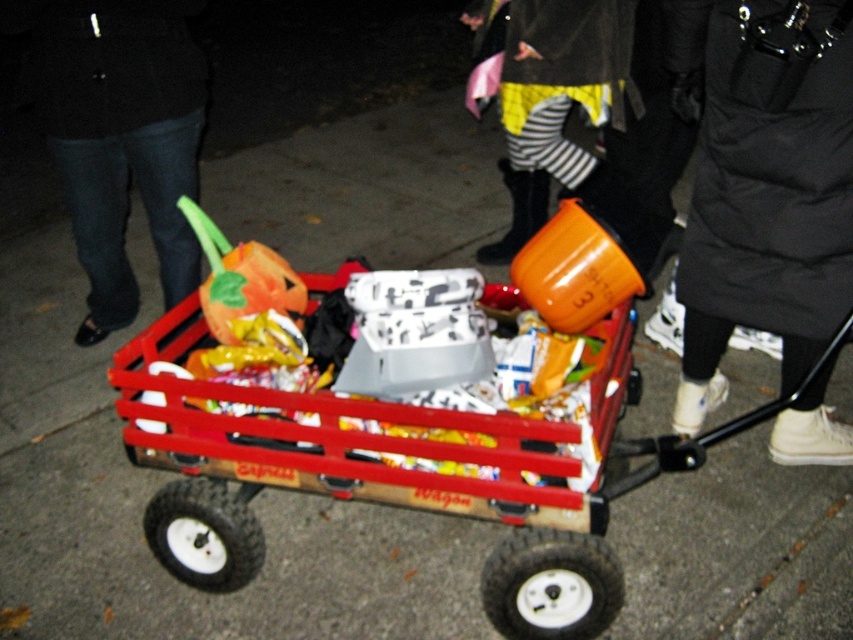
Looking at this image, you are a costume designer trying to decide which Halloween costume to wear tonight. You have two options in the image, the black puffy coat at upper right and the striped fabric pants at center. Which costume piece is narrower?

The black puffy coat at upper right has a lesser width compared to striped fabric pants at center, so the black puffy coat at upper right is narrower.

You are organizing a Halloween costume party and need to arrange two pairs of pants in the wagon. The brushed metal pants at lower left and the striped fabric pants at center are both in the wagon. Which pair of pants is wider?

The brushed metal pants at lower left is wider than the striped fabric pants at center.

You are a delivery person who needs to place a package between the brushed metal pants at lower left and the striped fabric pants at center. The package is 4 feet long. Will it fit between them?

The distance between the brushed metal pants at lower left and the striped fabric pants at center is 4.12 feet, so the 4 feet long package will fit between them.